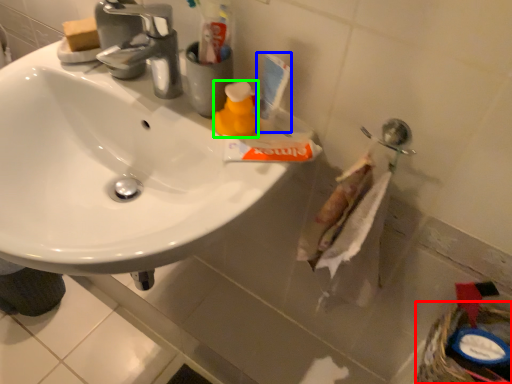
Question: Which object is positioned farthest from basket (highlighted by a red box)? Select from toiletry (highlighted by a blue box) and cleaning product (highlighted by a green box).

Choices:
 (A) toiletry
 (B) cleaning product

Answer: (B)